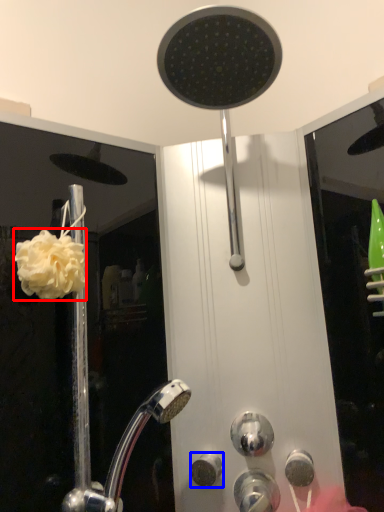
Question: Which object appears closest to the camera in this image, flower (highlighted by a red box) or knob (highlighted by a blue box)?

Choices:
 (A) flower
 (B) knob

Answer: (A)